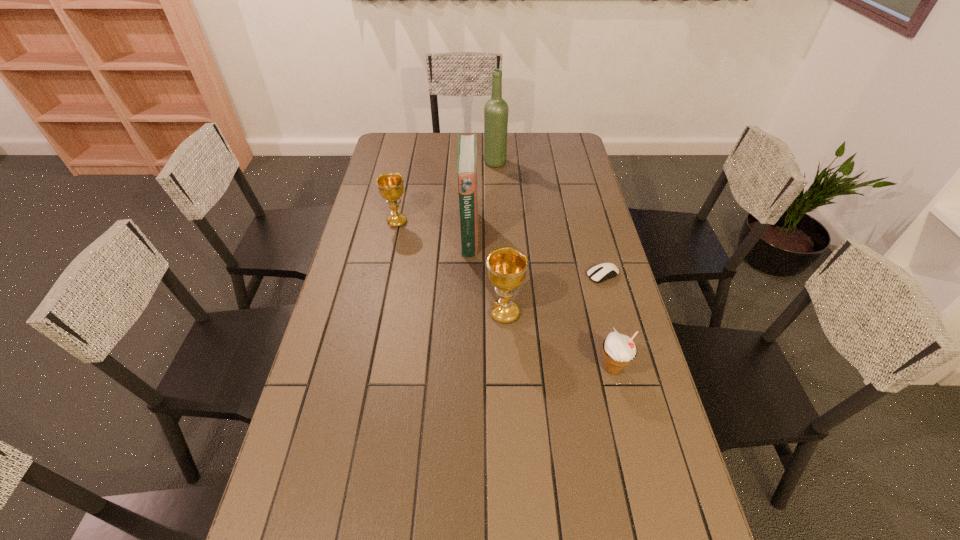
This screenshot has width=960, height=540. What are the coordinates of `the farther chalice` in the screenshot? It's located at (391, 187).

Find the location of a particular element. The image size is (960, 540). the fourth tallest object is located at coordinates (391, 187).

Locate an element on the screen. The height and width of the screenshot is (540, 960). the right chalice is located at coordinates (507, 267).

Locate an element on the screen. The height and width of the screenshot is (540, 960). the third tallest object is located at coordinates (507, 267).

The height and width of the screenshot is (540, 960). I want to click on the farthest object, so click(496, 109).

At what (x,y) coordinates should I click in order to perform the action: click on hardback book. Please return your answer as a coordinate pair (x, y). The height and width of the screenshot is (540, 960). Looking at the image, I should click on (467, 148).

The height and width of the screenshot is (540, 960). In order to click on the second object from left to right in this screenshot , I will do `click(467, 148)`.

The width and height of the screenshot is (960, 540). In order to click on the third nearest object in this screenshot , I will do `click(599, 273)`.

This screenshot has width=960, height=540. In order to click on the shortest object in this screenshot , I will do `click(599, 273)`.

Locate an element on the screen. The height and width of the screenshot is (540, 960). the nearest object is located at coordinates (619, 350).